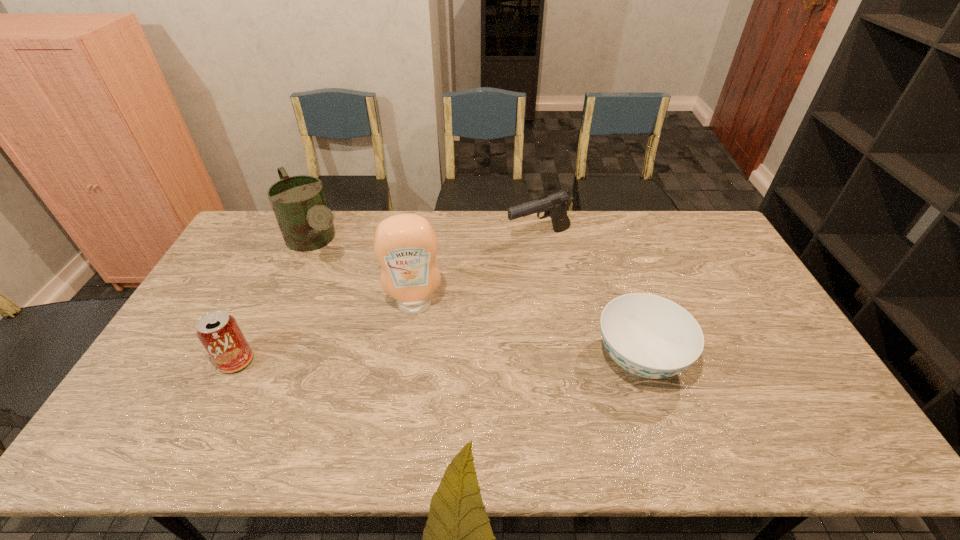
This screenshot has height=540, width=960. I want to click on vacant space located 0.100m with the spout on the fourth shortest object, so click(342, 289).

Locate an element on the screen. This screenshot has width=960, height=540. vacant region located at the muzzle of the gun is located at coordinates (508, 276).

Identify the location of vacant region located 0.090m at the muzzle of the gun. This screenshot has height=540, width=960. (516, 264).

Locate an element on the screen. vacant area situated at the muzzle of the gun is located at coordinates (500, 288).

Find the location of a particular element. Image resolution: width=960 pixels, height=540 pixels. blank area located on the label of the third object from left to right is located at coordinates (418, 349).

Where is `free spot located on the label of the third object from left to right`? free spot located on the label of the third object from left to right is located at coordinates (419, 373).

I want to click on free space located 0.270m on the label of the third object from left to right, so click(420, 396).

Where is `watering can at the far edge`? The width and height of the screenshot is (960, 540). watering can at the far edge is located at coordinates (299, 203).

Image resolution: width=960 pixels, height=540 pixels. Identify the location of gun that is at the far edge. (554, 206).

Where is `object that is at the near edge`? The image size is (960, 540). object that is at the near edge is located at coordinates (650, 336).